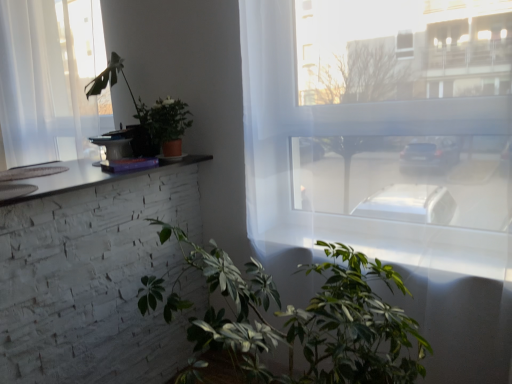
Question: From the image's perspective, would you say matte brown pot at upper center, the second houseplant when ordered from top to bottom, is positioned over green matte plant at upper left, which is counted as the 3th houseplant, starting from the bottom?

Choices:
 (A) no
 (B) yes

Answer: (A)

Question: Is matte brown pot at upper center, the second houseplant when ordered from top to bottom, positioned far away from green matte plant at upper left, which is the 1th houseplant from top to bottom?

Choices:
 (A) no
 (B) yes

Answer: (A)

Question: Considering the relative sizes of matte brown pot at upper center, the second houseplant when ordered from top to bottom, and green matte plant at upper left, which is the 1th houseplant from top to bottom, in the image provided, is matte brown pot at upper center, the second houseplant when ordered from top to bottom, thinner than green matte plant at upper left, which is the 1th houseplant from top to bottom,?

Choices:
 (A) yes
 (B) no

Answer: (A)

Question: Does matte brown pot at upper center, the second houseplant when ordered from top to bottom, contain green matte plant at upper left, which is counted as the 3th houseplant, starting from the bottom?

Choices:
 (A) yes
 (B) no

Answer: (B)

Question: From a real-world perspective, is matte brown pot at upper center, the second houseplant when ordered from top to bottom, on top of green matte plant at upper left, which is counted as the 3th houseplant, starting from the bottom?

Choices:
 (A) no
 (B) yes

Answer: (A)

Question: From the image's perspective, is green matte plant at lower center, positioned as the third houseplant in top-to-bottom order, above or below matte brown pot at upper center, the second houseplant when ordered from top to bottom?

Choices:
 (A) above
 (B) below

Answer: (B)

Question: Is green matte plant at lower center, positioned as the third houseplant in top-to-bottom order, situated inside matte brown pot at upper center, the 2th houseplant in the bottom-to-top sequence, or outside?

Choices:
 (A) inside
 (B) outside

Answer: (B)

Question: From a real-world perspective, relative to matte brown pot at upper center, the second houseplant when ordered from top to bottom, is green matte plant at lower center, positioned as the third houseplant in top-to-bottom order, vertically above or below?

Choices:
 (A) above
 (B) below

Answer: (B)

Question: In terms of height, does green matte plant at lower center, positioned as the first houseplant in bottom-to-top order, look taller or shorter compared to matte brown pot at upper center, the 2th houseplant in the bottom-to-top sequence?

Choices:
 (A) tall
 (B) short

Answer: (A)

Question: From a real-world perspective, is transparent glass window at center, arranged as the 2th window when viewed from the left, physically located above or below matte brown pot at upper center, the 2th houseplant in the bottom-to-top sequence?

Choices:
 (A) below
 (B) above

Answer: (A)

Question: Is transparent glass window at center, which appears as the second window when viewed from the back, in front of or behind matte brown pot at upper center, the second houseplant when ordered from top to bottom, in the image?

Choices:
 (A) front
 (B) behind

Answer: (A)

Question: Is transparent glass window at center, arranged as the 2th window when viewed from the left, bigger or smaller than matte brown pot at upper center, the second houseplant when ordered from top to bottom?

Choices:
 (A) small
 (B) big

Answer: (B)

Question: Would you say transparent glass window at center, the first window from the front, is inside or outside matte brown pot at upper center, the 2th houseplant in the bottom-to-top sequence?

Choices:
 (A) inside
 (B) outside

Answer: (B)

Question: Is green matte plant at upper left, which is counted as the 3th houseplant, starting from the bottom, to the left or to the right of green matte plant at lower center, positioned as the first houseplant in bottom-to-top order, in the image?

Choices:
 (A) left
 (B) right

Answer: (A)

Question: In terms of height, does green matte plant at upper left, which is counted as the 3th houseplant, starting from the bottom, look taller or shorter compared to green matte plant at lower center, positioned as the first houseplant in bottom-to-top order?

Choices:
 (A) tall
 (B) short

Answer: (B)